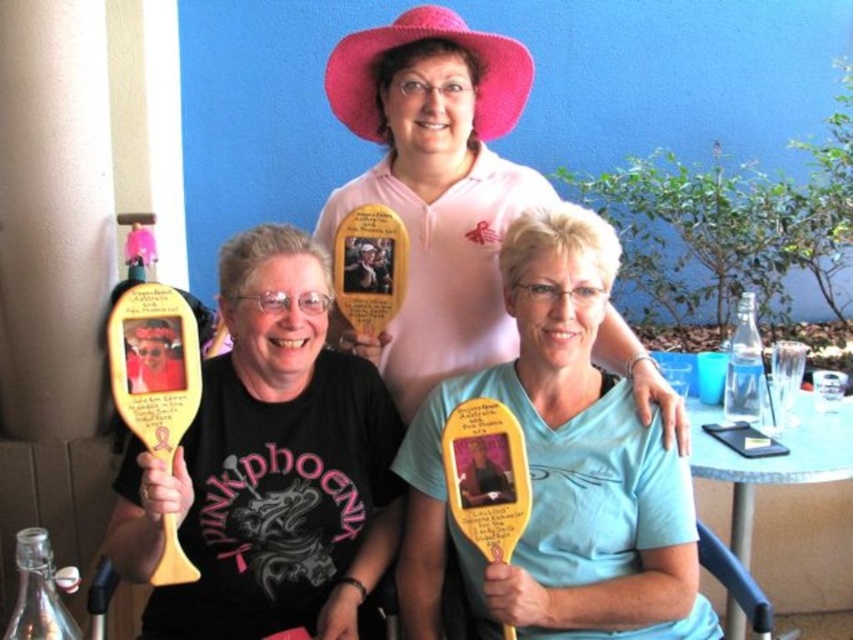
Can you confirm if matte wooden paddle at center is wider than blue plastic table at lower right?

No, matte wooden paddle at center is not wider than blue plastic table at lower right.

Is matte wooden paddle at center to the left of blue plastic table at lower right from the viewer's perspective?

Correct, you'll find matte wooden paddle at center to the left of blue plastic table at lower right.

Between point (251, 371) and point (820, 566), which one is positioned behind?

Positioned behind is point (820, 566).

Locate an element on the screen. Image resolution: width=853 pixels, height=640 pixels. matte wooden paddle at center is located at coordinates [270, 467].

Can you confirm if pink matte hat at upper center is shorter than blue plastic table at lower right?

Incorrect, pink matte hat at upper center's height does not fall short of blue plastic table at lower right's.

Is pink matte hat at upper center positioned in front of blue plastic table at lower right?

Yes, it is in front of blue plastic table at lower right.

Find the location of a particular element. The height and width of the screenshot is (640, 853). pink matte hat at upper center is located at coordinates (434, 186).

Does point (625, 552) come behind point (740, 296)?

No, it is in front of (740, 296).

Is point (648, 499) farther from viewer compared to point (727, 380)?

No, (648, 499) is closer to viewer.

Identify the location of light blue fabric shirt at center. This screenshot has width=853, height=640. (560, 468).